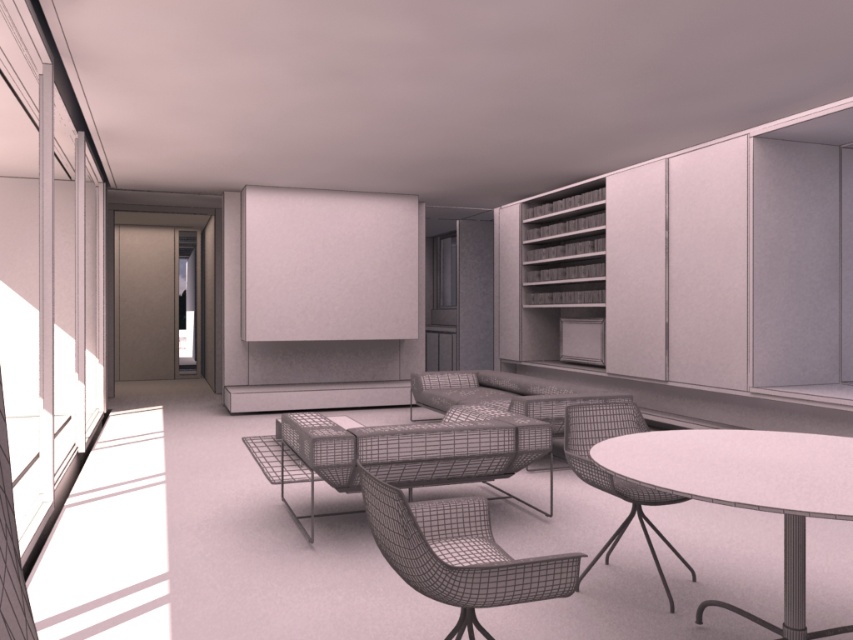
You are standing in the center of the room and see two points marked on the floor. One is labeled as point (840,467) and the other as point (668,500). Which point is closer to you?

Point (840,467) is in front of point (668,500), so it is closer to you.

You are standing at the entrance of the room and want to move towards the wireframe mesh chair at center. Based on the coordinates provided, in which direction should you move relative to your current position?

The wireframe mesh chair at center is located at coordinates point (457, 554), so you should move towards the right and forward to reach it.

You are standing in the center of the room and want to move towards the nearest point between point (746, 464) and point (439, 404). Which point should you walk towards?

You should walk towards point (746, 464) because it is closer to you than point (439, 404).